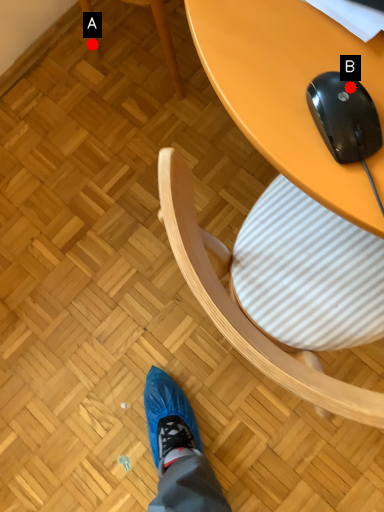
Question: Two points are circled on the image, labeled by A and B beside each circle. Which point is farther from the camera taking this photo?

Choices:
 (A) A is further
 (B) B is further

Answer: (A)